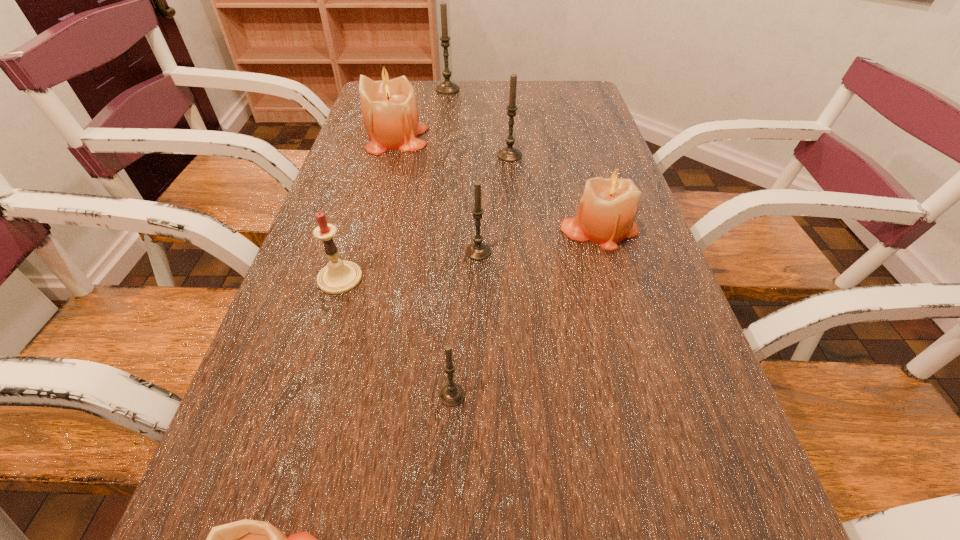
The width and height of the screenshot is (960, 540). I want to click on the second nearest object, so click(x=452, y=394).

The width and height of the screenshot is (960, 540). What are the coordinates of `the smallest gray candle` in the screenshot? It's located at (452, 394).

You are a GUI agent. You are given a task and a screenshot of the screen. Output one action in this format:
    pyautogui.click(x=<x>, y=<y>)
    Task: Click on the free location located 0.060m on the front of the leftmost gray candle
    The width and height of the screenshot is (960, 540).
    Given the screenshot: What is the action you would take?
    pyautogui.click(x=446, y=103)

Find the location of a particular element. vacant region located 0.110m on the right of the second object from right to left is located at coordinates (562, 156).

At what (x,y) coordinates should I click in order to perform the action: click on vacant position located on the right of the biggest beige candle. Please return your answer as a coordinate pair (x, y). This screenshot has height=540, width=960. Looking at the image, I should click on (511, 138).

Image resolution: width=960 pixels, height=540 pixels. Find the location of `free spot located 0.200m on the back of the third farthest gray candle`. free spot located 0.200m on the back of the third farthest gray candle is located at coordinates [x=478, y=190].

Identify the location of vacant region located on the back of the sixth farthest object. (372, 171).

Where is `vacant region located on the back of the second farthest beige candle`? The width and height of the screenshot is (960, 540). vacant region located on the back of the second farthest beige candle is located at coordinates (579, 160).

Image resolution: width=960 pixels, height=540 pixels. What are the coordinates of `vacant space located on the back of the second nearest candle` in the screenshot? It's located at [x=460, y=228].

Identify the location of object at the far edge. The image size is (960, 540). (447, 87).